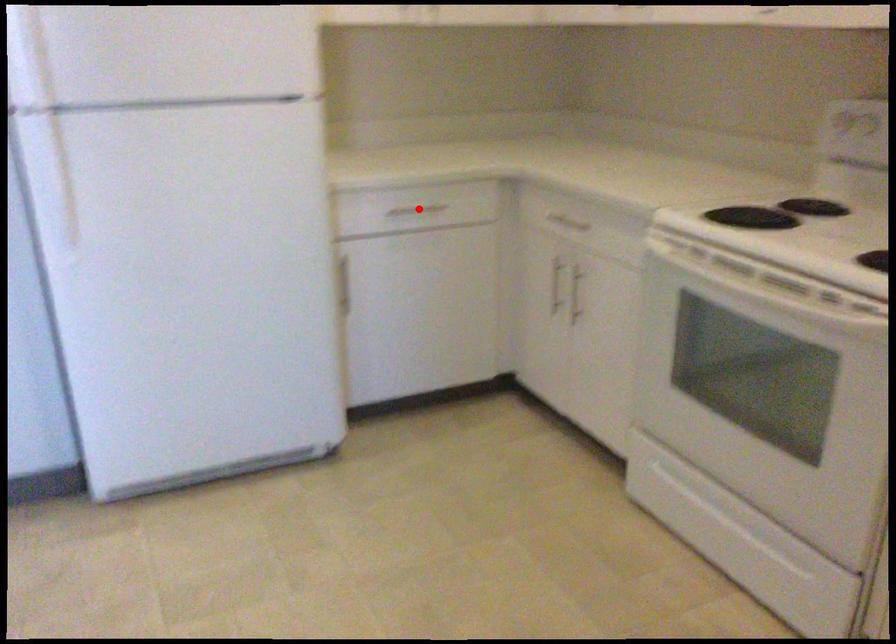
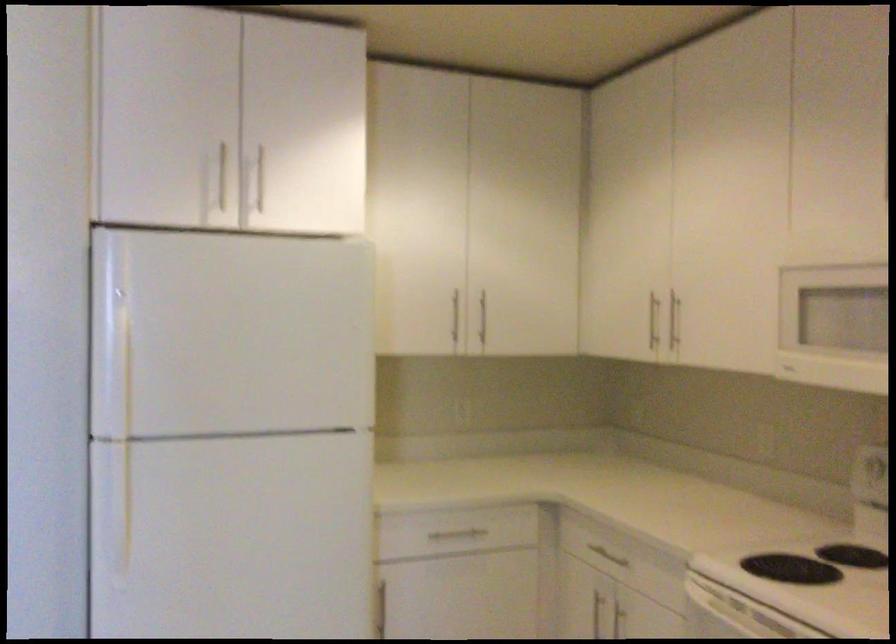
In the second image, find the point that corresponds to the highlighted location in the first image.

(455, 536)